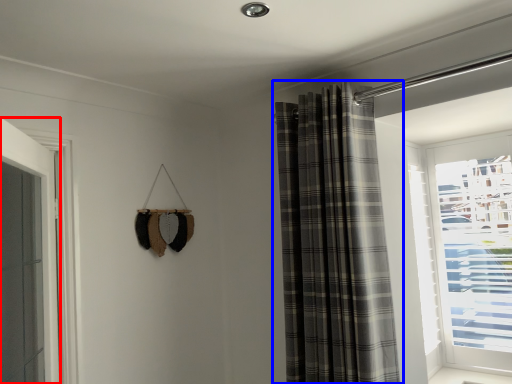
Question: Which object appears closest to the camera in this image, door (highlighted by a red box) or curtain (highlighted by a blue box)?

Choices:
 (A) door
 (B) curtain

Answer: (A)